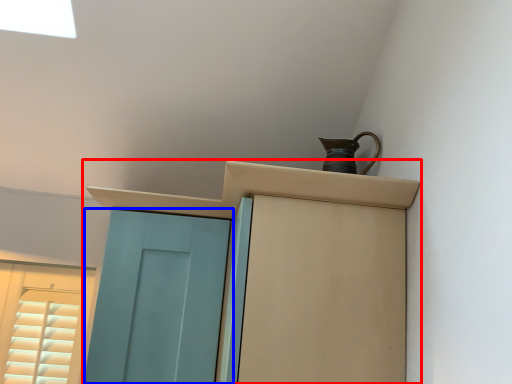
Question: Which point is further to the camera, cupboard (highlighted by a red box) or door (highlighted by a blue box)?

Choices:
 (A) cupboard
 (B) door

Answer: (B)